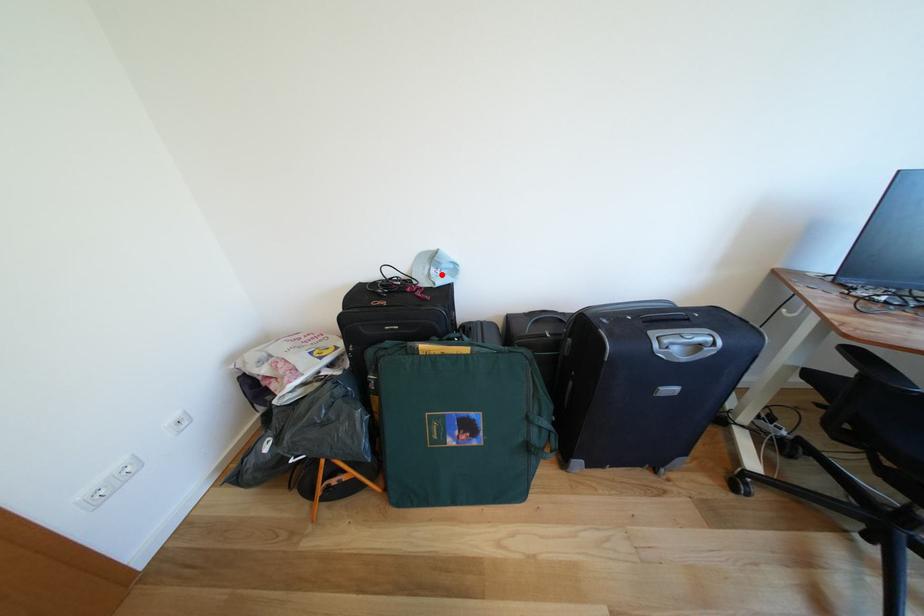
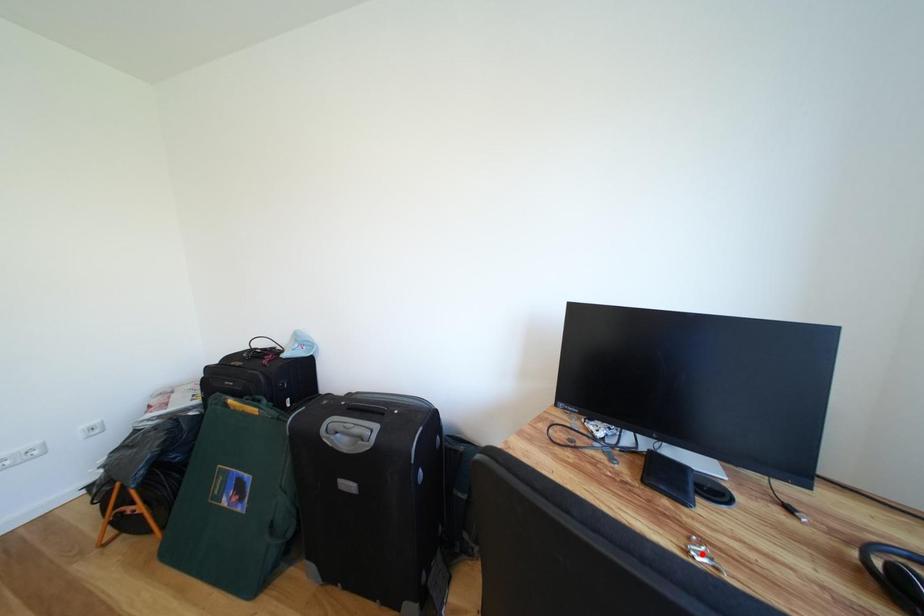
Consider the image. I am providing you with two images of the same scene from different viewpoints. A red point is marked on the first image and another point is marked on the second image. Is the red point in image1 aligned with the point shown in image2?

No